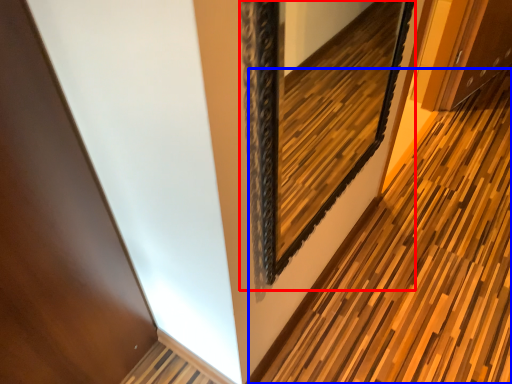
Question: Which point is further to the camera, picture frame (highlighted by a red box) or path (highlighted by a blue box)?

Choices:
 (A) picture frame
 (B) path

Answer: (B)